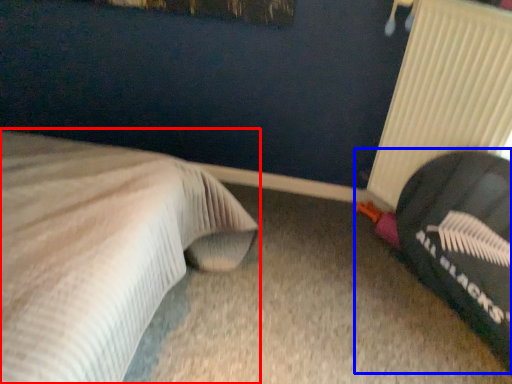
Question: Which point is closer to the camera, bed (highlighted by a red box) or bean bag chair (highlighted by a blue box)?

Choices:
 (A) bed
 (B) bean bag chair

Answer: (A)